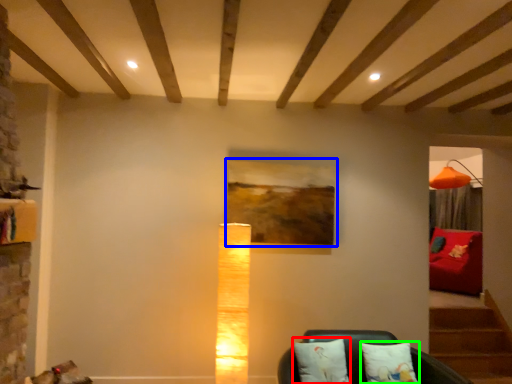
Question: Which object is positioned farthest from pillow (highlighted by a red box)? Select from picture frame (highlighted by a blue box) and pillow (highlighted by a green box).

Choices:
 (A) picture frame
 (B) pillow

Answer: (A)